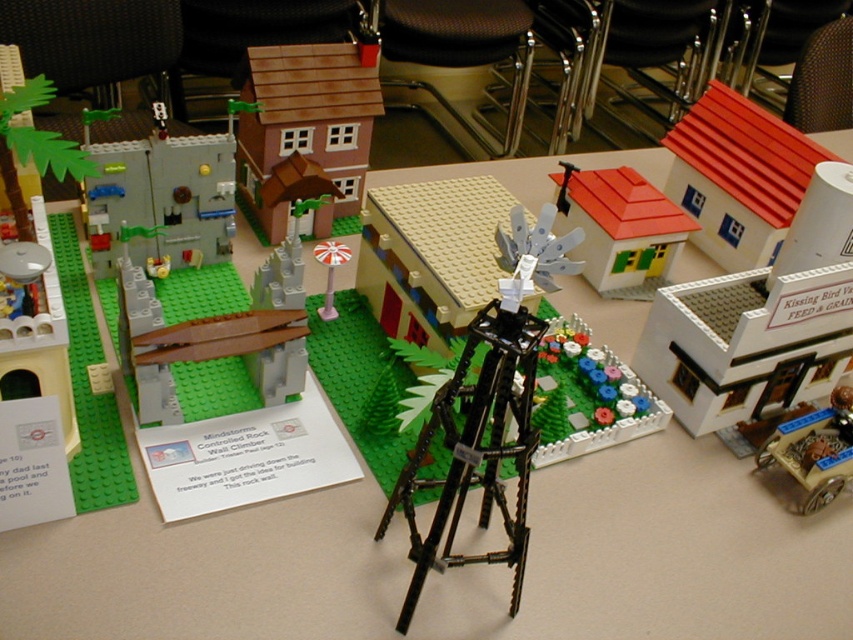
Can you confirm if white matte building at center-right is thinner than brown matte house at upper center?

No, white matte building at center-right is not thinner than brown matte house at upper center.

Between point (792, 236) and point (361, 120), which one is positioned in front?

Point (792, 236)

At what (x,y) coordinates should I click in order to perform the action: click on white matte building at center-right. Please return your answer as a coordinate pair (x, y). The image size is (853, 640). Looking at the image, I should click on (759, 321).

Who is more forward, (720, 241) or (131, 257)?

Point (131, 257)

Which is above, smooth plastic house at upper right or smooth gray wall at left?

smooth plastic house at upper right is higher up.

Between point (766, 115) and point (202, 179), which one is positioned in front?

Point (202, 179)

Locate an element on the screen. The height and width of the screenshot is (640, 853). smooth plastic house at upper right is located at coordinates (738, 177).

Is white matte building at center-right positioned at the back of wooden cart at lower right?

Yes, white matte building at center-right is behind wooden cart at lower right.

Based on the photo, who is more distant from viewer, (x=822, y=236) or (x=815, y=504)?

Point (x=822, y=236)

Is point (808, 390) in front of point (799, 509)?

That is False.

This screenshot has height=640, width=853. I want to click on white matte building at center-right, so 759,321.